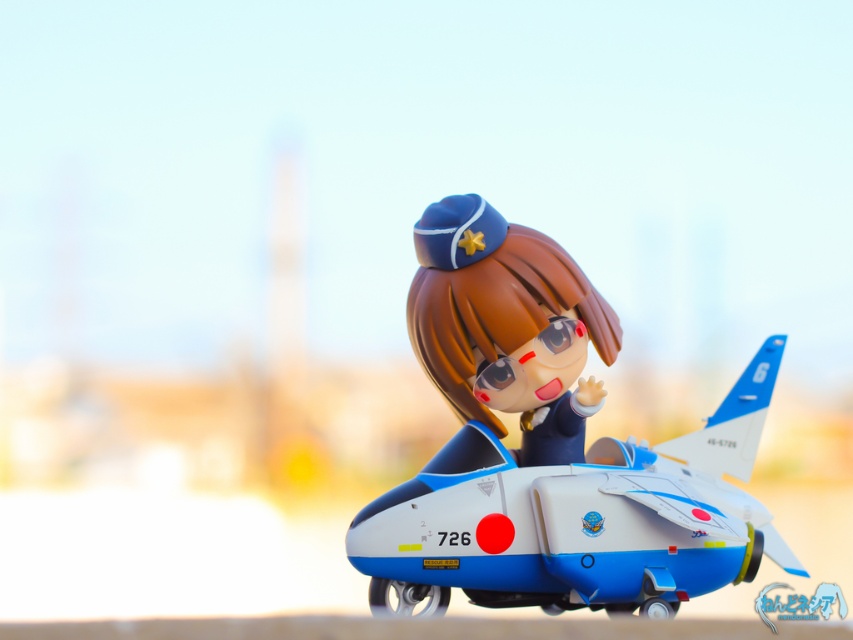
Question: From the image, what is the correct spatial relationship of blue plastic airplane at center in relation to satin blue uniform at center?

Choices:
 (A) right
 (B) left

Answer: (A)

Question: Which of the following is the closest to the observer?

Choices:
 (A) blue plastic airplane at center
 (B) satin blue uniform at center

Answer: (A)

Question: Among these objects, which one is farthest from the camera?

Choices:
 (A) blue plastic airplane at center
 (B) satin blue uniform at center

Answer: (B)

Question: Is blue plastic airplane at center closer to the viewer compared to satin blue uniform at center?

Choices:
 (A) yes
 (B) no

Answer: (A)

Question: Is blue plastic airplane at center bigger than satin blue uniform at center?

Choices:
 (A) yes
 (B) no

Answer: (A)